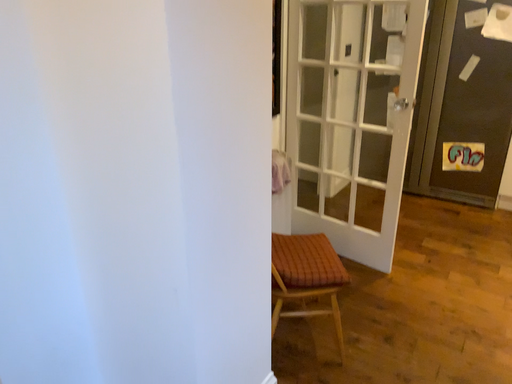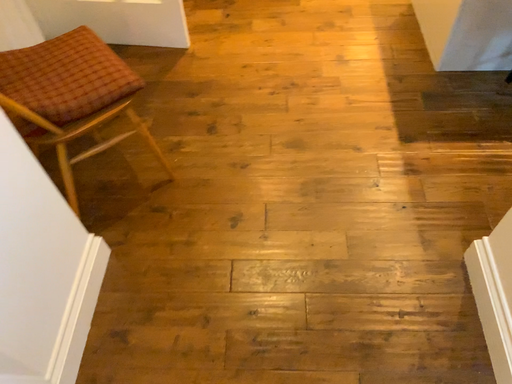
Question: Which way did the camera rotate in the video?

Choices:
 (A) rotated left
 (B) rotated right

Answer: (B)